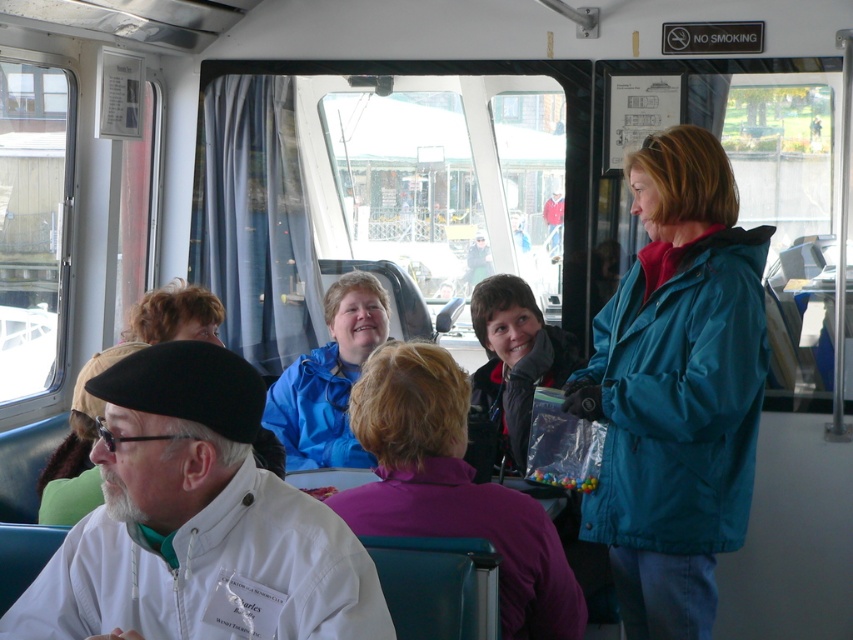
Does point (218, 436) come behind point (337, 289)?

No, (218, 436) is closer to viewer.

Between white matte coat at lower left and blue matte jacket at center, which one is positioned lower?

white matte coat at lower left is lower down.

At what (x,y) coordinates should I click in order to perform the action: click on white matte coat at lower left. Please return your answer as a coordinate pair (x, y). Looking at the image, I should click on (196, 522).

Find the location of a particular element. This screenshot has width=853, height=640. white matte coat at lower left is located at coordinates (196, 522).

Is point (193, 512) farther from viewer compared to point (579, 362)?

No, it is in front of (579, 362).

Find the location of a particular element. white matte coat at lower left is located at coordinates (196, 522).

Identify the location of white matte coat at lower left. The image size is (853, 640). (196, 522).

Is white matte coat at lower left positioned behind purple fleece jacket at center?

No, white matte coat at lower left is in front of purple fleece jacket at center.

Is point (229, 518) farther from viewer compared to point (426, 403)?

No, it is in front of (426, 403).

Locate an element on the screen. This screenshot has width=853, height=640. white matte coat at lower left is located at coordinates [196, 522].